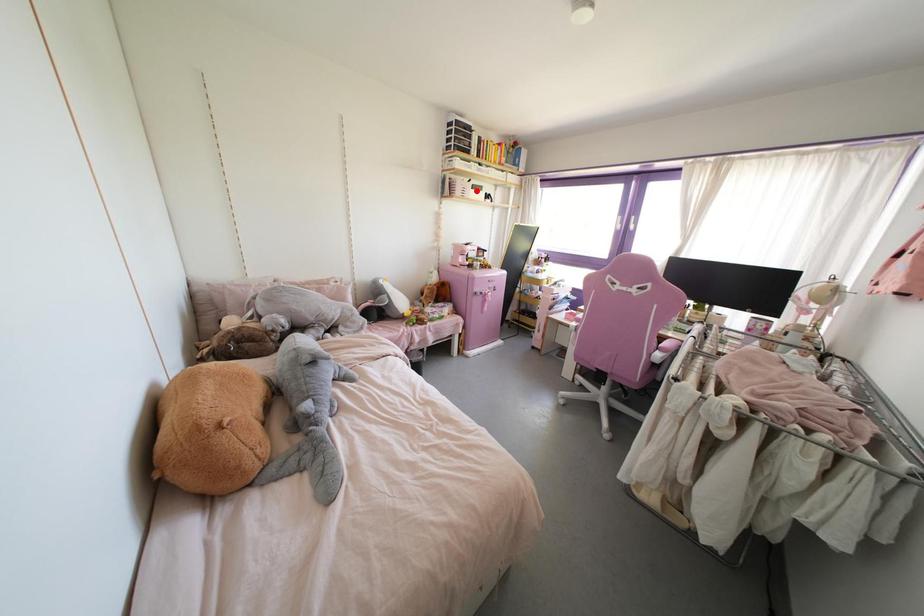
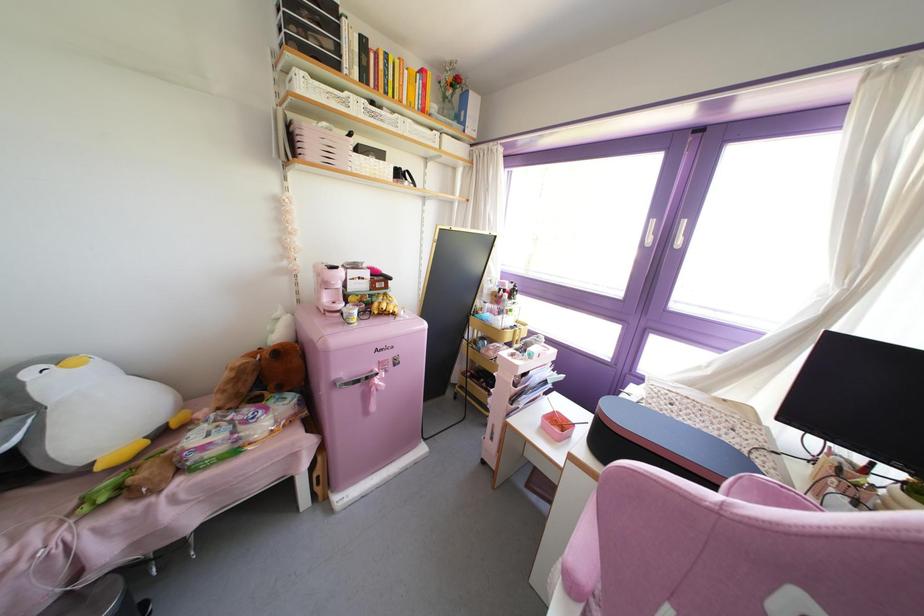
Question: I am providing you with two images of the same scene from different viewpoints. Given a red point in image1, look at the same physical point in image2. Is it:

Choices:
 (A) Closer to the viewpoint
 (B) Farther from the viewpoint

Answer: (B)